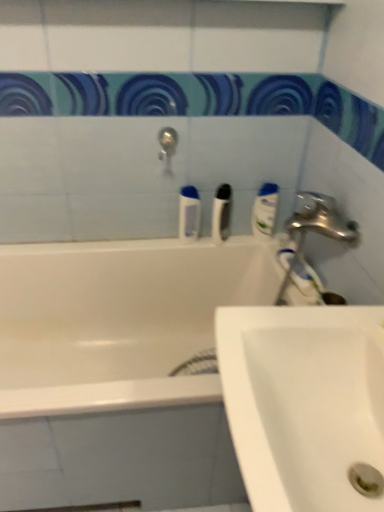
What is the approximate height of white glossy toothpaste at right?

white glossy toothpaste at right is 1.68 inches in height.

This screenshot has height=512, width=384. Describe the element at coordinates (118, 321) in the screenshot. I see `white glossy bathtub at center` at that location.

The width and height of the screenshot is (384, 512). What do you see at coordinates (303, 402) in the screenshot?
I see `white ceramic sink at lower right` at bounding box center [303, 402].

Locate an element on the screen. The image size is (384, 512). white plastic toothbrush at center is located at coordinates (x=221, y=213).

I want to click on blue glossy mouthwash at center, the first mouthwash from the left, so click(x=189, y=214).

From the image's perspective, which one is positioned lower, white plastic toothbrush at center or white glossy bathtub at upper center?

white glossy bathtub at upper center is shown below in the image.

Considering the sizes of objects white plastic toothbrush at center and white glossy bathtub at upper center in the image provided, who is wider, white plastic toothbrush at center or white glossy bathtub at upper center?

Wider between the two is white glossy bathtub at upper center.

Is point (221, 224) closer or farther from the camera than point (50, 163)?

Point (221, 224) is positioned farther from the camera compared to point (50, 163).

Consider the image. Would you consider white plastic toothbrush at center to be distant from white glossy bathtub at upper center?

They are positioned close to each other.

What are the coordinates of `bathtub located underneath the white glossy mouthwash at upper right, acting as the second mouthwash starting from the left (from a real-world perspective)` in the screenshot? It's located at (135, 261).

Is white glossy bathtub at upper center looking in the opposite direction of white glossy mouthwash at upper right, acting as the second mouthwash starting from the left?

No, white glossy bathtub at upper center is not facing the opposite direction of white glossy mouthwash at upper right, acting as the second mouthwash starting from the left.

Is white glossy bathtub at upper center smaller than white glossy mouthwash at upper right, acting as the second mouthwash starting from the left?

No, white glossy bathtub at upper center is not smaller than white glossy mouthwash at upper right, acting as the second mouthwash starting from the left.

How many degrees apart are the facing directions of white glossy bathtub at upper center and white glossy mouthwash at upper right, which ranks as the first mouthwash in right-to-left order?

90 degrees separate the facing orientations of white glossy bathtub at upper center and white glossy mouthwash at upper right, which ranks as the first mouthwash in right-to-left order.

How distant is white glossy bathtub at upper center from silver metallic tap at upper center?

16.32 inches.

I want to click on tap that appears on the left of white glossy bathtub at upper center, so click(x=167, y=147).

Which point is more forward, (234, 233) or (169, 140)?

The point (169, 140) is more forward.

From a real-world perspective, which object stands above the other?

silver metallic tap at upper center, from a real-world perspective.

From the image's perspective, is white glossy mouthwash at upper right, which ranks as the first mouthwash in right-to-left order, under white glossy bathtub at upper center?

No, from the image's perspective, white glossy mouthwash at upper right, which ranks as the first mouthwash in right-to-left order, is not beneath white glossy bathtub at upper center.

Could you measure the distance between white glossy mouthwash at upper right, which ranks as the first mouthwash in right-to-left order, and white glossy bathtub at upper center?

white glossy mouthwash at upper right, which ranks as the first mouthwash in right-to-left order, is 17.10 inches from white glossy bathtub at upper center.

Consider the image. Between white glossy mouthwash at upper right, which ranks as the first mouthwash in right-to-left order, and white glossy bathtub at upper center, which one has more height?

With more height is white glossy bathtub at upper center.

Between point (263, 224) and point (105, 168), which one is positioned in front?

The point (105, 168) is closer.

What's the angular difference between blue glossy mouthwash at center, the first mouthwash from the left, and white glossy mouthwash at upper right, which ranks as the first mouthwash in right-to-left order,'s facing directions?

The angular difference between blue glossy mouthwash at center, the first mouthwash from the left, and white glossy mouthwash at upper right, which ranks as the first mouthwash in right-to-left order, is 5.14e-05 degrees.

Could you measure the distance between blue glossy mouthwash at center, the second mouthwash viewed from the right, and white glossy mouthwash at upper right, which ranks as the first mouthwash in right-to-left order?

blue glossy mouthwash at center, the second mouthwash viewed from the right, is 9.31 inches away from white glossy mouthwash at upper right, which ranks as the first mouthwash in right-to-left order.

Where is `mouthwash on the left of white glossy mouthwash at upper right, acting as the second mouthwash starting from the left`? Image resolution: width=384 pixels, height=512 pixels. mouthwash on the left of white glossy mouthwash at upper right, acting as the second mouthwash starting from the left is located at coordinates (189, 214).

Which point is more forward, (192, 193) or (270, 232)?

The point (192, 193) is closer to the camera.

Is white glossy bathtub at upper center with white plastic toothbrush at center?

They are not placed beside each other.

Is white glossy bathtub at upper center smaller than white plastic toothbrush at center?

Incorrect, white glossy bathtub at upper center is not smaller in size than white plastic toothbrush at center.

From a real-world perspective, is white glossy bathtub at upper center physically located above or below white plastic toothbrush at center?

Clearly, from a real-world perspective, white glossy bathtub at upper center is below white plastic toothbrush at center.

Visually, is white glossy bathtub at upper center positioned to the left or to the right of white plastic toothbrush at center?

white glossy bathtub at upper center is positioned on white plastic toothbrush at center's left side.

Is white glossy bathtub at center wider or thinner than blue glossy mouthwash at center, the first mouthwash from the left?

In the image, white glossy bathtub at center appears to be wider than blue glossy mouthwash at center, the first mouthwash from the left.

Is white glossy bathtub at center to the left of blue glossy mouthwash at center, the second mouthwash viewed from the right, from the viewer's perspective?

Yes.

Is white glossy bathtub at center positioned far away from blue glossy mouthwash at center, the first mouthwash from the left?

No, white glossy bathtub at center is not far away from blue glossy mouthwash at center, the first mouthwash from the left.

Image resolution: width=384 pixels, height=512 pixels. Find the location of `bathtub in front of the white plastic toothbrush at center`. bathtub in front of the white plastic toothbrush at center is located at coordinates (135, 261).

Find the location of a particular element. mouthwash that is the 2nd one when counting backward from the white glossy bathtub at upper center is located at coordinates (265, 211).

Based on their spatial positions, is blue glossy mouthwash at center, the first mouthwash from the left, or white glossy bathtub at upper center closer to white glossy toothpaste at right?

Among the two, blue glossy mouthwash at center, the first mouthwash from the left, is located nearer to white glossy toothpaste at right.

Based on their spatial positions, is white glossy bathtub at center or white ceramic sink at lower right closer to white glossy mouthwash at upper right, acting as the second mouthwash starting from the left?

white glossy bathtub at center lies closer to white glossy mouthwash at upper right, acting as the second mouthwash starting from the left, than the other object.

From the image, which object appears to be nearer to white plastic toothbrush at center, blue glossy mouthwash at center, the first mouthwash from the left, or silver metallic tap at upper center?

The object closer to white plastic toothbrush at center is blue glossy mouthwash at center, the first mouthwash from the left.

Based on their spatial positions, is white glossy bathtub at upper center or white plastic toothbrush at center closer to white glossy toothpaste at right?

white plastic toothbrush at center.

Considering their positions, is blue glossy mouthwash at center, the second mouthwash viewed from the right, positioned closer to white glossy bathtub at upper center than white glossy mouthwash at upper right, acting as the second mouthwash starting from the left?

blue glossy mouthwash at center, the second mouthwash viewed from the right.

From the image, which object appears to be farther from blue glossy mouthwash at center, the first mouthwash from the left, white plastic toothbrush at center or white glossy mouthwash at upper right, acting as the second mouthwash starting from the left?

Among the two, white glossy mouthwash at upper right, acting as the second mouthwash starting from the left, is located further to blue glossy mouthwash at center, the first mouthwash from the left.

From the image, which object appears to be farther from blue glossy mouthwash at center, the first mouthwash from the left, white glossy bathtub at upper center or white plastic toothbrush at center?

white glossy bathtub at upper center lies further to blue glossy mouthwash at center, the first mouthwash from the left, than the other object.

Estimate the real-world distances between objects in this image. Which object is further from white ceramic sink at lower right, silver metallic tap at upper center or white glossy mouthwash at upper right, which ranks as the first mouthwash in right-to-left order?

silver metallic tap at upper center is further to white ceramic sink at lower right.

The width and height of the screenshot is (384, 512). What are the coordinates of `bathtub situated between white glossy bathtub at center and white glossy toothpaste at right from left to right` in the screenshot? It's located at (135, 261).

Identify the location of mouthwash located between white glossy bathtub at upper center and white glossy mouthwash at upper right, acting as the second mouthwash starting from the left, in the depth direction. The image size is (384, 512). (189, 214).

The width and height of the screenshot is (384, 512). In order to click on tap located between white ceramic sink at lower right and white glossy toothpaste at right in the depth direction in this screenshot , I will do `click(167, 147)`.

At what (x,y) coordinates should I click in order to perform the action: click on mouthwash situated between white plastic toothbrush at center and white glossy toothpaste at right from left to right. Please return your answer as a coordinate pair (x, y). Looking at the image, I should click on (265, 211).